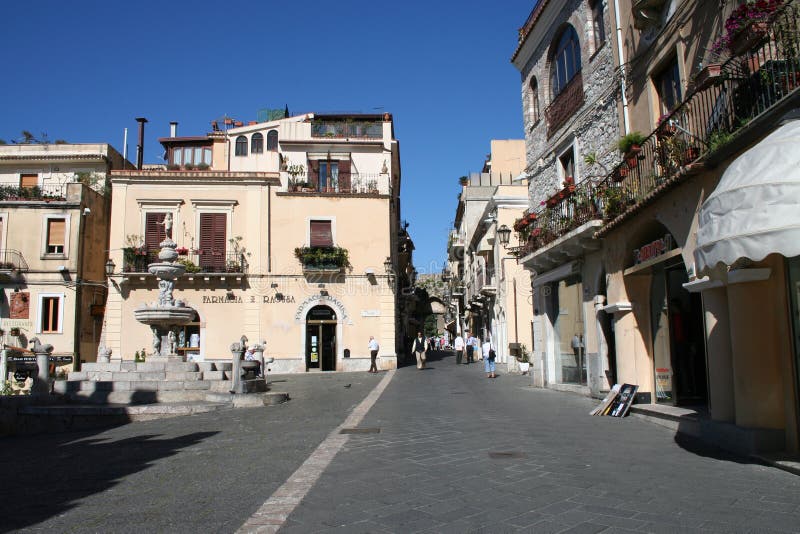
Locate an element on the screen. The height and width of the screenshot is (534, 800). plant pot is located at coordinates (634, 151).